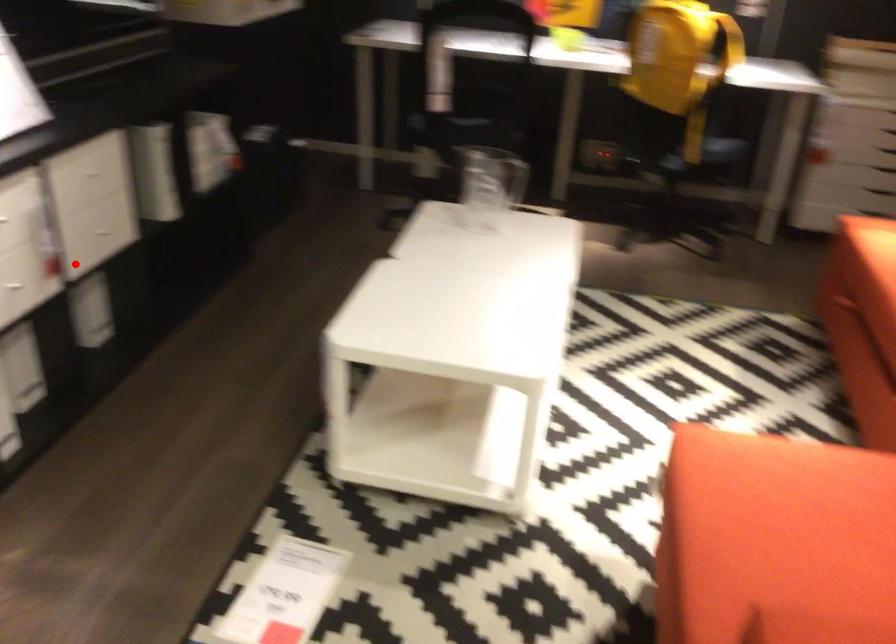
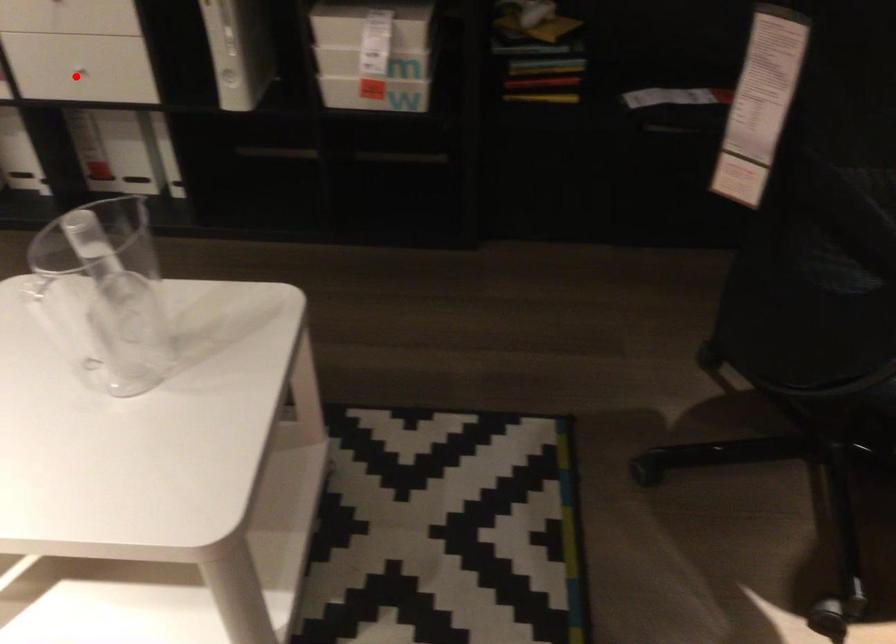
I am providing you with two images of the same scene from different viewpoints. A red point is marked on the first image and another point is marked on the second image. Is the red point in image1 aligned with the point shown in image2?

Yes